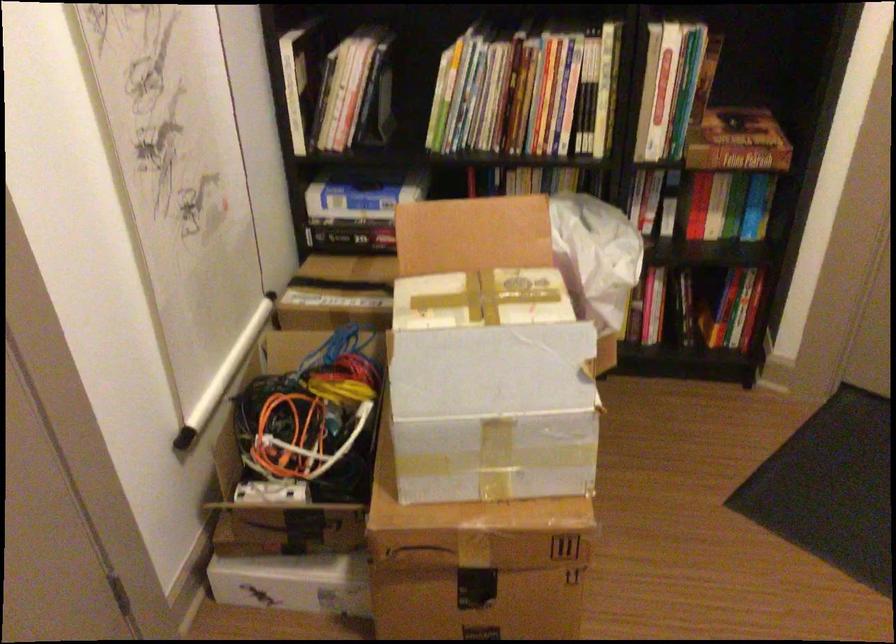
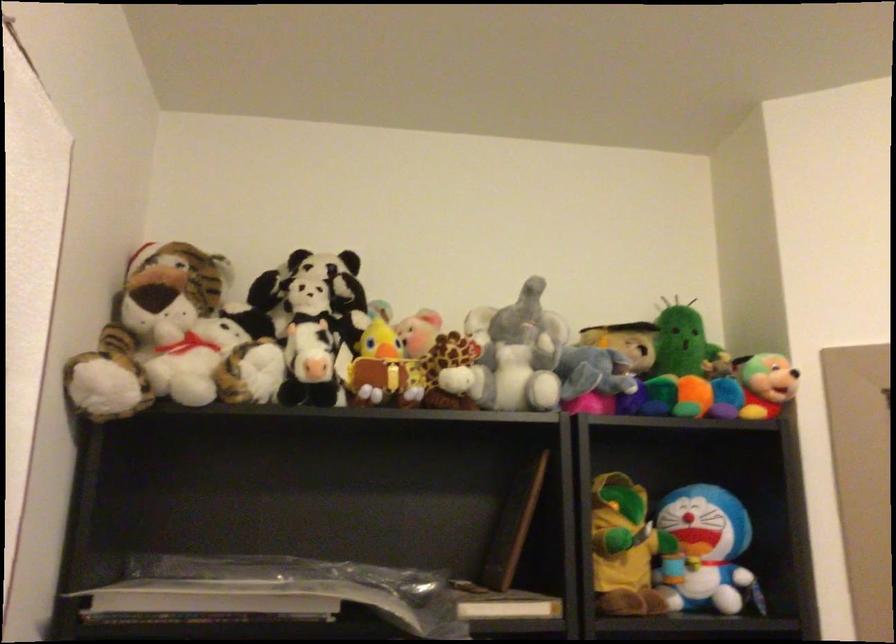
In the scene shown: How did the camera likely rotate?

The camera rotated toward right-up.